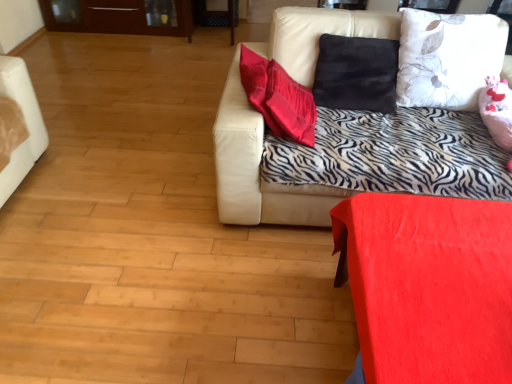
Find the location of `empty space that is ontop of matte red table at lower right (from a real-world perspective)`. empty space that is ontop of matte red table at lower right (from a real-world perspective) is located at coordinates (442, 284).